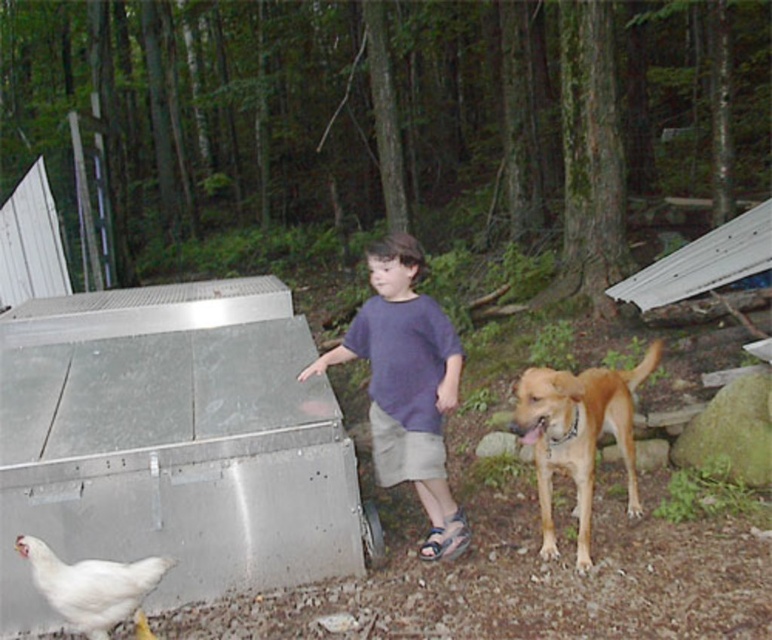
Between golden fur dog at center and white matte chicken at lower left, which one is positioned lower?

white matte chicken at lower left is below.

Can you confirm if golden fur dog at center is thinner than white matte chicken at lower left?

In fact, golden fur dog at center might be wider than white matte chicken at lower left.

Image resolution: width=772 pixels, height=640 pixels. Describe the element at coordinates (579, 435) in the screenshot. I see `golden fur dog at center` at that location.

Locate an element on the screen. Image resolution: width=772 pixels, height=640 pixels. golden fur dog at center is located at coordinates (579, 435).

Between purple cotton shirt at center and white matte chicken at lower left, which one is positioned higher?

purple cotton shirt at center

Does purple cotton shirt at center come in front of white matte chicken at lower left?

That is False.

What are the coordinates of `purple cotton shirt at center` in the screenshot? It's located at (405, 385).

Locate an element on the screen. Image resolution: width=772 pixels, height=640 pixels. purple cotton shirt at center is located at coordinates (405, 385).

Can you confirm if purple cotton shirt at center is positioned above golden fur dog at center?

Yes, purple cotton shirt at center is above golden fur dog at center.

Can you confirm if purple cotton shirt at center is smaller than golden fur dog at center?

Yes, purple cotton shirt at center is smaller than golden fur dog at center.

Does point (408, 365) come farther from viewer compared to point (579, 540)?

That is True.

Where is `purple cotton shirt at center`? The height and width of the screenshot is (640, 772). purple cotton shirt at center is located at coordinates (405, 385).